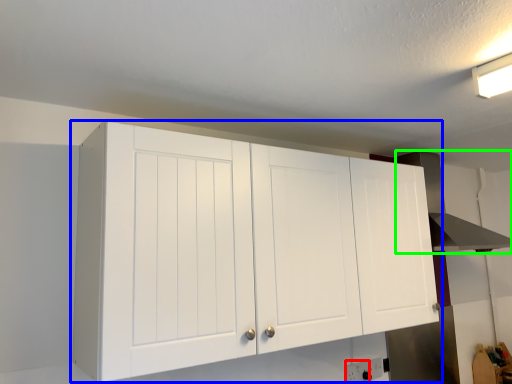
Question: Estimate the real-world distances between objects in this image. Which object is closer to electric outlet (highlighted by a red box), cupboard (highlighted by a blue box) or vent (highlighted by a green box)?

Choices:
 (A) cupboard
 (B) vent

Answer: (A)